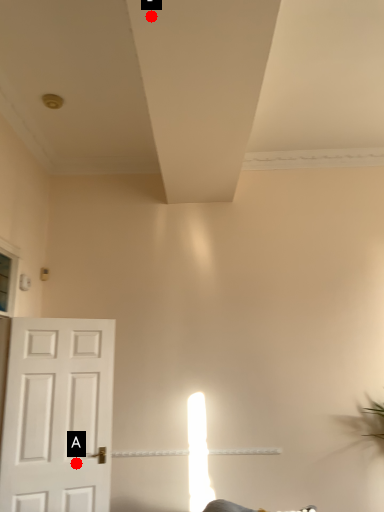
Question: Two points are circled on the image, labeled by A and B beside each circle. Which point appears closest to the camera in this image?

Choices:
 (A) A is closer
 (B) B is closer

Answer: (B)